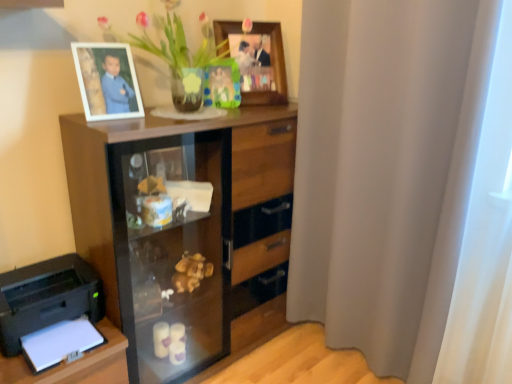
Question: Is white matte picture frame at upper left, arranged as the 1th picture frame when viewed from the left, in contact with wooden picture frame at upper center, the 3th picture frame in the left-to-right sequence?

Choices:
 (A) no
 (B) yes

Answer: (A)

Question: Can you confirm if white matte picture frame at upper left, the 3th picture frame in the right-to-left sequence, is positioned to the right of wooden picture frame at upper center, placed as the second picture frame when sorted from back to front?

Choices:
 (A) no
 (B) yes

Answer: (A)

Question: Considering the relative positions of white matte picture frame at upper left, the 3th picture frame in the right-to-left sequence, and wooden picture frame at upper center, marked as the 2th picture frame in a front-to-back arrangement, in the image provided, is white matte picture frame at upper left, the 3th picture frame in the right-to-left sequence, to the left of wooden picture frame at upper center, marked as the 2th picture frame in a front-to-back arrangement, from the viewer's perspective?

Choices:
 (A) no
 (B) yes

Answer: (B)

Question: Is white matte picture frame at upper left, the first picture frame in the front-to-back sequence, positioned beyond the bounds of wooden picture frame at upper center, marked as the 2th picture frame in a front-to-back arrangement?

Choices:
 (A) yes
 (B) no

Answer: (A)

Question: From a real-world perspective, is white matte picture frame at upper left, which ranks as the 3th picture frame in back-to-front order, beneath wooden picture frame at upper center, the first picture frame viewed from the right?

Choices:
 (A) yes
 (B) no

Answer: (A)

Question: From the image's perspective, does white matte picture frame at upper left, which ranks as the 3th picture frame in back-to-front order, appear lower than wooden picture frame at upper center, the first picture frame viewed from the right?

Choices:
 (A) no
 (B) yes

Answer: (B)

Question: Is translucent glass vase at upper center aimed at white matte picture frame at upper left, the 3th picture frame in the right-to-left sequence?

Choices:
 (A) no
 (B) yes

Answer: (A)

Question: From a real-world perspective, is translucent glass vase at upper center under white matte picture frame at upper left, which ranks as the 3th picture frame in back-to-front order?

Choices:
 (A) no
 (B) yes

Answer: (A)

Question: From the image's perspective, is translucent glass vase at upper center below white matte picture frame at upper left, the first picture frame in the front-to-back sequence?

Choices:
 (A) yes
 (B) no

Answer: (B)

Question: Is translucent glass vase at upper center thinner than white matte picture frame at upper left, which ranks as the 3th picture frame in back-to-front order?

Choices:
 (A) yes
 (B) no

Answer: (B)

Question: Is translucent glass vase at upper center turned away from white matte picture frame at upper left, the 3th picture frame in the right-to-left sequence?

Choices:
 (A) yes
 (B) no

Answer: (B)

Question: Would you consider translucent glass vase at upper center to be distant from white matte picture frame at upper left, which ranks as the 3th picture frame in back-to-front order?

Choices:
 (A) yes
 (B) no

Answer: (B)

Question: Is the depth of black plastic printer at lower left greater than that of translucent glass vase at upper center?

Choices:
 (A) yes
 (B) no

Answer: (B)